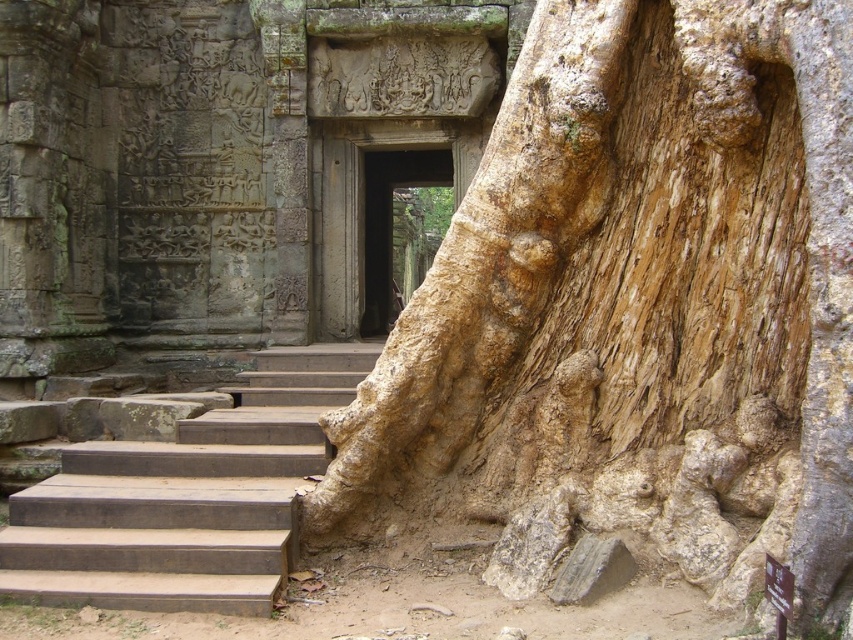
Question: In this image, where is light brown rough bark at center located relative to brown wooden stairs at center?

Choices:
 (A) right
 (B) left

Answer: (A)

Question: Is light brown rough bark at center to the right of brown stone door at center from the viewer's perspective?

Choices:
 (A) no
 (B) yes

Answer: (B)

Question: Which of the following is the farthest from the observer?

Choices:
 (A) (560, 216)
 (B) (370, 300)

Answer: (B)

Question: Which object is the closest to the brown wooden stairs at center?

Choices:
 (A) light brown rough bark at center
 (B) brown stone door at center

Answer: (A)

Question: Which of the following is the farthest from the observer?

Choices:
 (A) (386, 209)
 (B) (322, 388)

Answer: (A)

Question: Is light brown rough bark at center to the left of brown wooden stairs at center from the viewer's perspective?

Choices:
 (A) no
 (B) yes

Answer: (A)